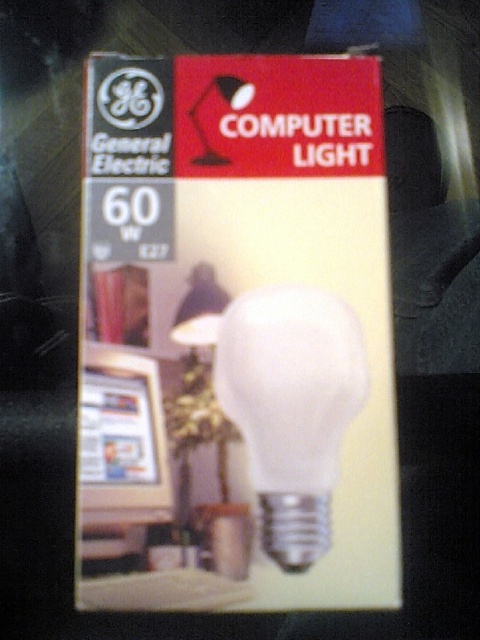
Which is below, white matte cardboard box at center or white matte bulb at center?

white matte bulb at center

Can you confirm if white matte cardboard box at center is taller than white matte bulb at center?

Yes, white matte cardboard box at center is taller than white matte bulb at center.

Between point (108, 132) and point (327, 516), which one is positioned in front?

Point (327, 516) is in front.

You are a GUI agent. You are given a task and a screenshot of the screen. Output one action in this format:
    pyautogui.click(x=<x>, y=<y>)
    Task: Click on the white matte cardboard box at center
    
    Given the screenshot: What is the action you would take?
    pyautogui.click(x=236, y=337)